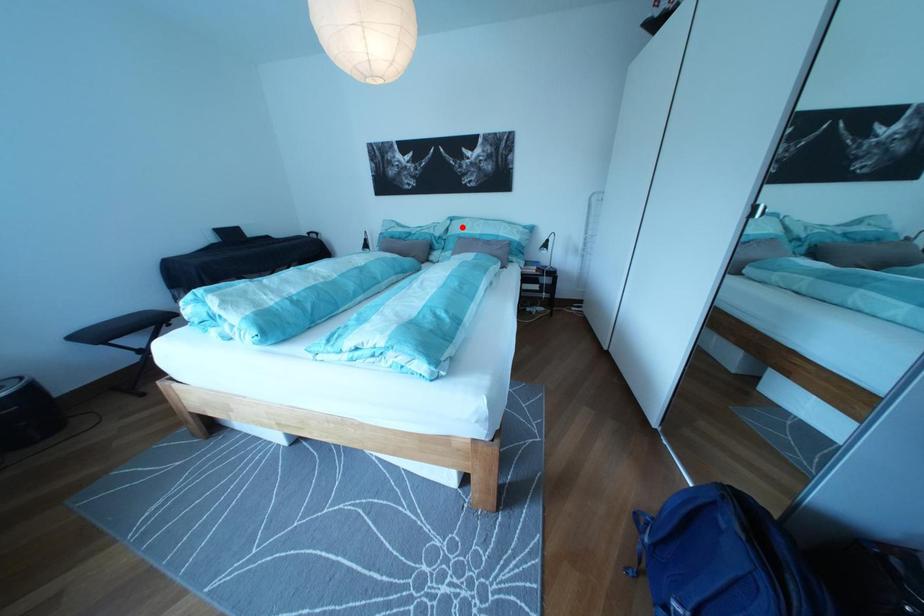
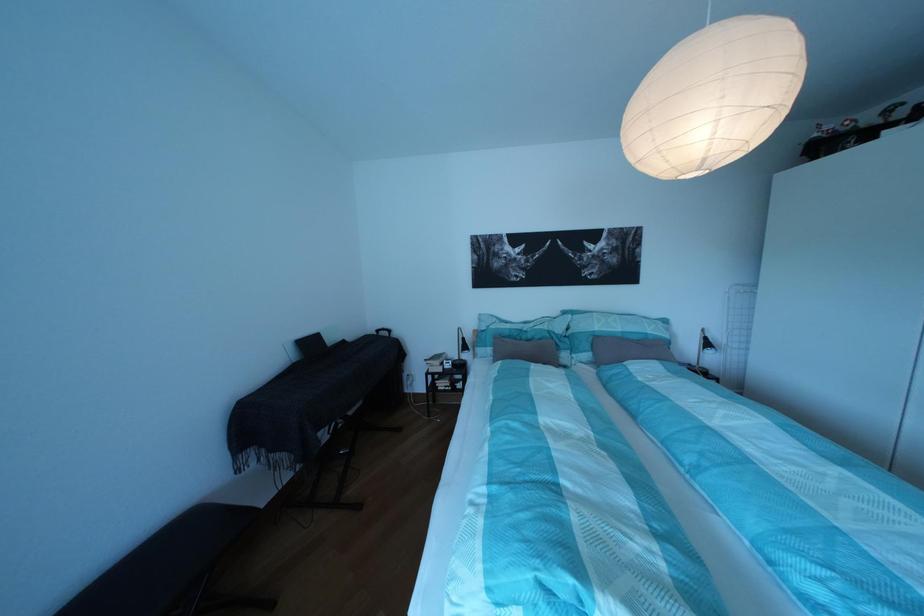
The point at the highlighted location is marked in the first image. Where is the corresponding point in the second image?

(582, 322)